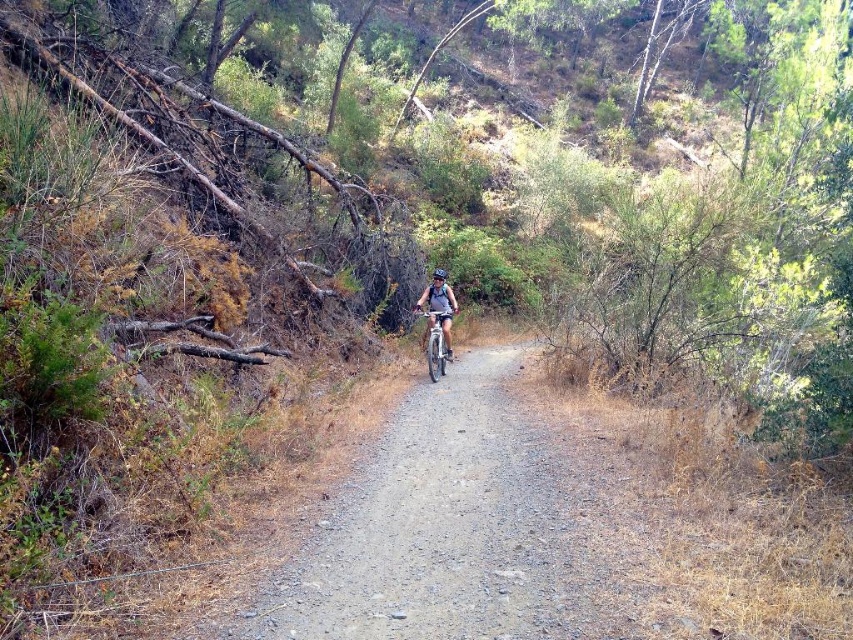
Which is above, dirt/gravel path at center or silver metallic bicycle at center?

silver metallic bicycle at center is higher up.

Between point (372, 534) and point (440, 362), which one is positioned behind?

The point (440, 362) is more distant.

Between point (457, 433) and point (439, 314), which one is positioned behind?

The point (439, 314) is behind.

Where is `dirt/gravel path at center`? The height and width of the screenshot is (640, 853). dirt/gravel path at center is located at coordinates (469, 529).

How much distance is there between dirt/gravel path at center and black matte bicycle helmet at center?

dirt/gravel path at center and black matte bicycle helmet at center are 9.67 meters apart from each other.

At what (x,y) coordinates should I click in order to perform the action: click on dirt/gravel path at center. Please return your answer as a coordinate pair (x, y). The image size is (853, 640). Looking at the image, I should click on (469, 529).

Is point (519, 445) in front of point (437, 269)?

Yes, it is in front of point (437, 269).

The width and height of the screenshot is (853, 640). I want to click on dirt/gravel path at center, so click(x=469, y=529).

Does matte gray helmet at center have a greater width compared to black matte bicycle helmet at center?

Yes.

Does point (430, 307) come in front of point (442, 268)?

Yes, it is in front of point (442, 268).

Describe the element at coordinates (439, 308) in the screenshot. I see `matte gray helmet at center` at that location.

Find the location of `matte gray helmet at center`. matte gray helmet at center is located at coordinates (439, 308).